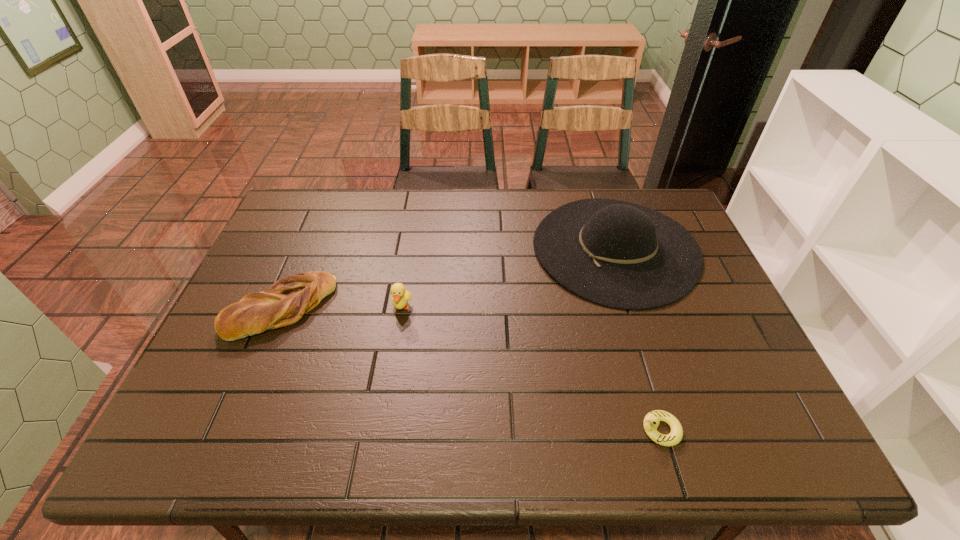
Where is `vacant point located 0.320m on the front-facing side of the farther duckling`? The width and height of the screenshot is (960, 540). vacant point located 0.320m on the front-facing side of the farther duckling is located at coordinates (381, 435).

Where is `vacant region located 0.070m on the back of the bread`? The width and height of the screenshot is (960, 540). vacant region located 0.070m on the back of the bread is located at coordinates (301, 260).

At what (x,y) coordinates should I click in order to perform the action: click on vacant space situated on the face of the nearer duckling. Please return your answer as a coordinate pair (x, y). This screenshot has width=960, height=540. Looking at the image, I should click on (565, 430).

Locate an element on the screen. The height and width of the screenshot is (540, 960). blank space located 0.140m on the face of the nearer duckling is located at coordinates (574, 430).

Locate an element on the screen. The height and width of the screenshot is (540, 960). vacant space situated 0.140m on the face of the nearer duckling is located at coordinates (574, 430).

Where is `object at the far edge`? The height and width of the screenshot is (540, 960). object at the far edge is located at coordinates (618, 254).

I want to click on object that is positioned at the near edge, so click(651, 421).

I want to click on object that is at the left edge, so click(x=288, y=299).

At what (x,y) coordinates should I click in order to perform the action: click on object situated at the right edge. Please return your answer as a coordinate pair (x, y). The width and height of the screenshot is (960, 540). Looking at the image, I should click on (618, 254).

Find the location of `object that is positioned at the far right corner`. object that is positioned at the far right corner is located at coordinates (618, 254).